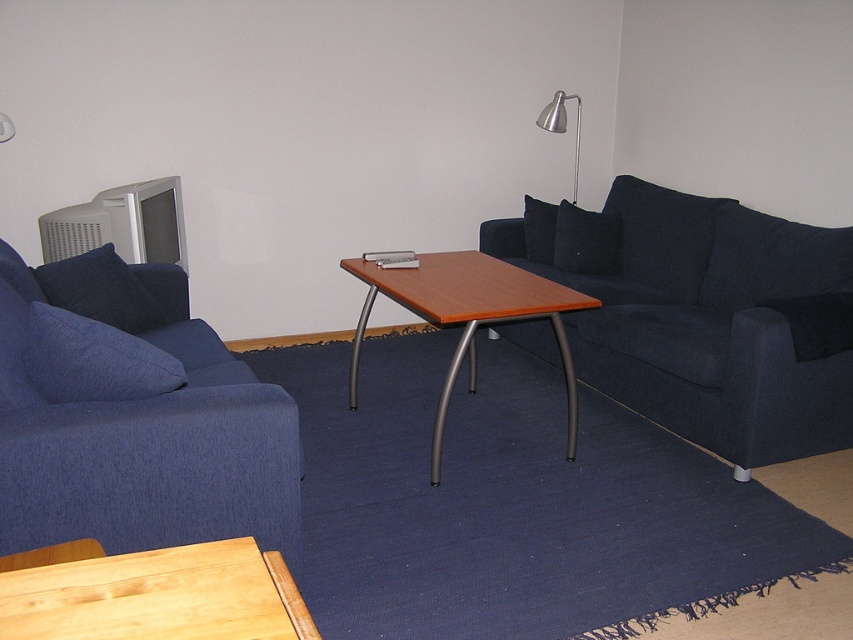
Question: Can you confirm if light brown wooden table at lower left is positioned above wooden/metallic side table at center?

Choices:
 (A) no
 (B) yes

Answer: (A)

Question: Which point is farther to the camera?

Choices:
 (A) wooden/metallic side table at center
 (B) denim blue sofa at left
 (C) light brown wooden table at lower left
 (D) denim cushion at left

Answer: (A)

Question: Which object is closer to the camera taking this photo?

Choices:
 (A) dark blue fabric couch at right
 (B) blue fabric pillow at left

Answer: (A)

Question: Is wooden/metallic side table at center positioned in front of metallic silver lamp at upper right?

Choices:
 (A) no
 (B) yes

Answer: (B)

Question: Which of the following is the farthest from the observer?

Choices:
 (A) (77, 340)
 (B) (527, 220)
 (C) (585, 268)

Answer: (B)

Question: Can you confirm if dark blue fabric pillow at upper right is positioned to the right of black fabric pillow at center?

Choices:
 (A) yes
 (B) no

Answer: (A)